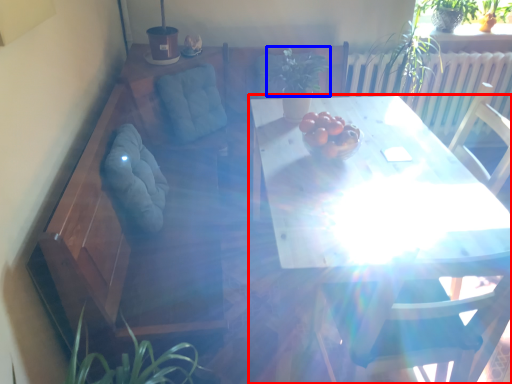
Question: Which object is further to the camera taking this photo, table (highlighted by a red box) or plant (highlighted by a blue box)?

Choices:
 (A) table
 (B) plant

Answer: (B)